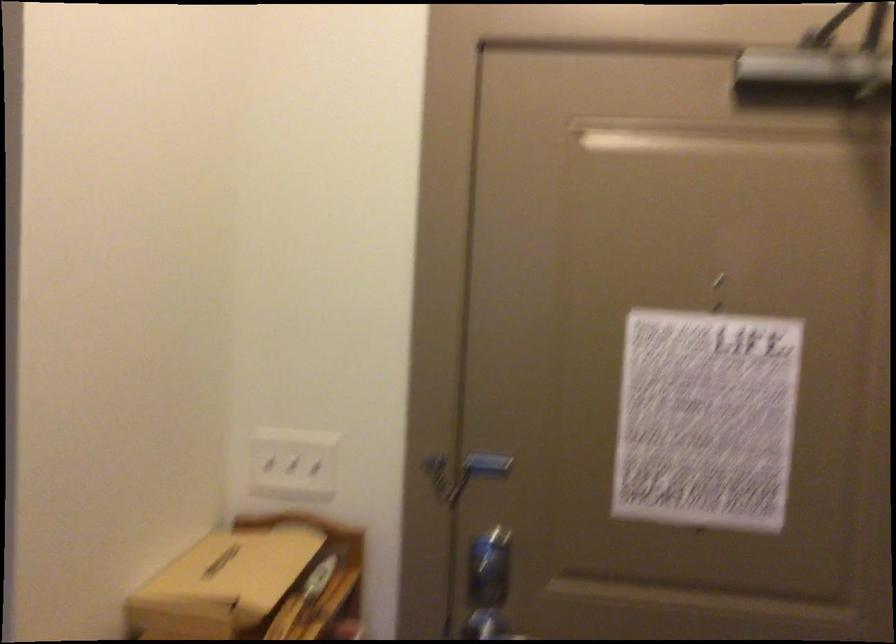
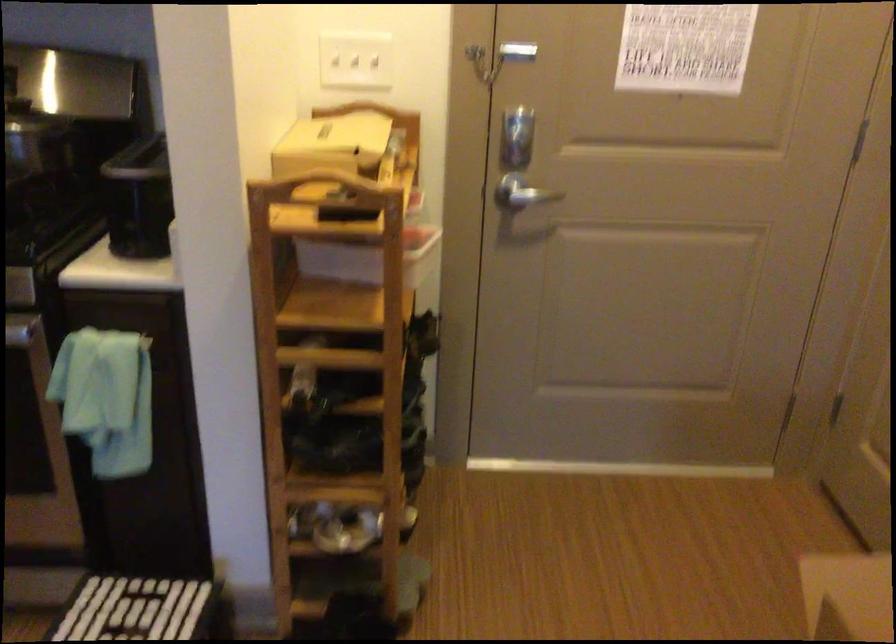
In the second image, find the point that corresponds to the point at 429,469 in the first image.

(478, 57)